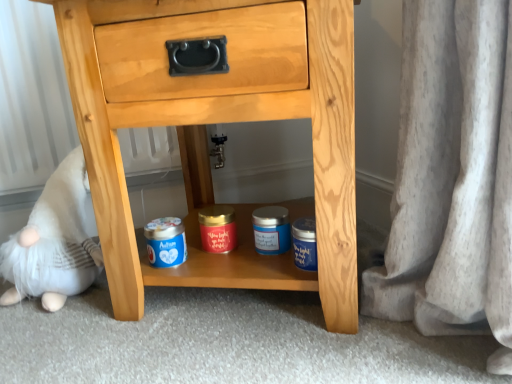
Question: From the image's perspective, is natural wood chest of drawers at center above or below white plush toy at lower left?

Choices:
 (A) below
 (B) above

Answer: (B)

Question: Looking at the image, does natural wood chest of drawers at center seem bigger or smaller compared to white plush toy at lower left?

Choices:
 (A) big
 (B) small

Answer: (A)

Question: From a real-world perspective, relative to white plush toy at lower left, is natural wood chest of drawers at center vertically above or below?

Choices:
 (A) above
 (B) below

Answer: (A)

Question: In the image, is white plush toy at lower left positioned in front of or behind natural wood chest of drawers at center?

Choices:
 (A) behind
 (B) front

Answer: (A)

Question: From the image's perspective, is white plush toy at lower left located above or below natural wood chest of drawers at center?

Choices:
 (A) above
 (B) below

Answer: (B)

Question: Considering the positions of white plush toy at lower left and natural wood chest of drawers at center in the image, is white plush toy at lower left bigger or smaller than natural wood chest of drawers at center?

Choices:
 (A) small
 (B) big

Answer: (A)

Question: Considering the positions of white plush toy at lower left and natural wood chest of drawers at center in the image, is white plush toy at lower left wider or thinner than natural wood chest of drawers at center?

Choices:
 (A) thin
 (B) wide

Answer: (A)